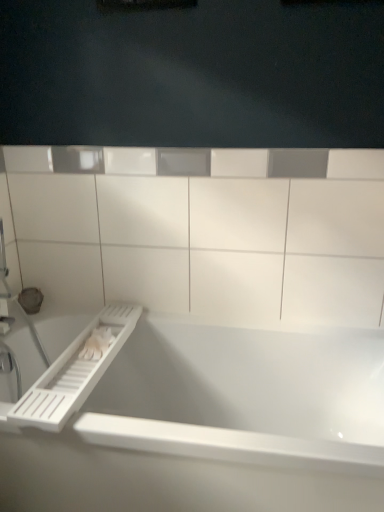
Identify the location of free point above white plastic towel bar at lower left (from a real-world perspective). (89, 347).